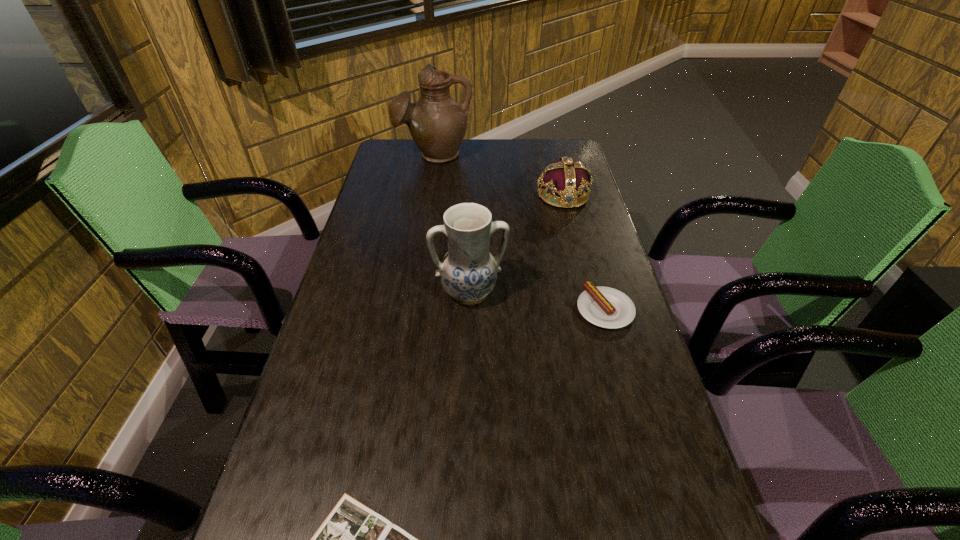
Find the location of `the farthest object`. the farthest object is located at coordinates point(437,123).

Where is `pitcher`? pitcher is located at coordinates (437, 123).

Identify the location of the second tallest object. (468, 272).

In order to click on the fourth nearest object in this screenshot , I will do `click(566, 178)`.

At what (x,y) coordinates should I click in order to perform the action: click on crown. Please return your answer as a coordinate pair (x, y). This screenshot has width=960, height=540. Looking at the image, I should click on (566, 178).

Image resolution: width=960 pixels, height=540 pixels. I want to click on sausage, so click(x=606, y=307).

Locate an element on the screen. The image size is (960, 540). blank space located 0.350m at the spout of the pitcher is located at coordinates (423, 226).

Find the location of a particular element. Image resolution: width=960 pixels, height=540 pixels. free space located 0.170m on the right of the pottery is located at coordinates (572, 293).

Identify the location of free spot located on the front of the fourth nearest object. (572, 231).

This screenshot has height=540, width=960. In order to click on free spot located 0.310m on the front of the sausage in this screenshot , I will do `click(647, 461)`.